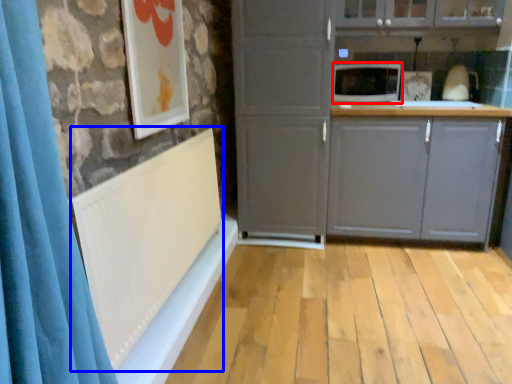
Question: Which object is further to the camera taking this photo, microwave oven (highlighted by a red box) or radiator (highlighted by a blue box)?

Choices:
 (A) microwave oven
 (B) radiator

Answer: (A)